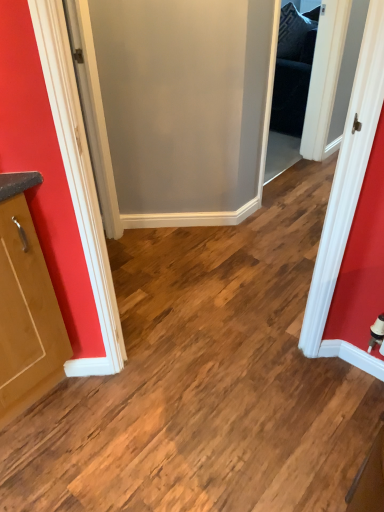
Where is `dark gray fabric screen door at upper right`? dark gray fabric screen door at upper right is located at coordinates (291, 87).

What is the approximate height of dark gray fabric screen door at upper right?

It is 3.79 feet.

Describe the element at coordinates (291, 87) in the screenshot. This screenshot has width=384, height=512. I see `dark gray fabric screen door at upper right` at that location.

The width and height of the screenshot is (384, 512). What are the coordinates of `dark gray fabric screen door at upper right` in the screenshot? It's located at (291, 87).